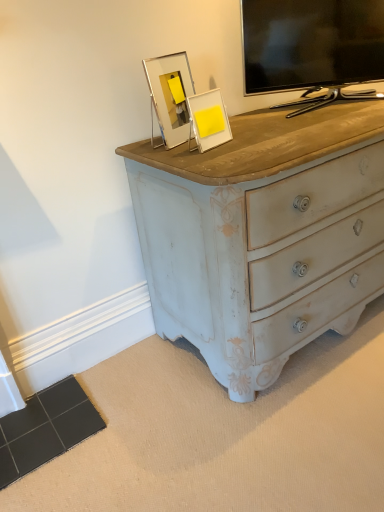
Question: Are clear acrylic frame at upper center, positioned as the 1th picture frame in left-to-right order, and black glossy tv at upper right located far from each other?

Choices:
 (A) no
 (B) yes

Answer: (A)

Question: Is clear acrylic frame at upper center, placed as the 2th picture frame when sorted from right to left, aimed at black glossy tv at upper right?

Choices:
 (A) no
 (B) yes

Answer: (A)

Question: Does clear acrylic frame at upper center, positioned as the 1th picture frame in left-to-right order, come in front of black glossy tv at upper right?

Choices:
 (A) yes
 (B) no

Answer: (A)

Question: Is clear acrylic frame at upper center, placed as the 2th picture frame when sorted from right to left, bigger than black glossy tv at upper right?

Choices:
 (A) yes
 (B) no

Answer: (B)

Question: Could black glossy tv at upper right be considered to be inside clear acrylic frame at upper center, placed as the 2th picture frame when sorted from right to left?

Choices:
 (A) yes
 (B) no

Answer: (B)

Question: From the image's perspective, would you say clear acrylic frame at upper center, placed as the 2th picture frame when sorted from right to left, is positioned over black glossy tv at upper right?

Choices:
 (A) yes
 (B) no

Answer: (B)

Question: Is black glossy tv at upper right wider than clear acrylic frame at upper center, placed as the 2th picture frame when sorted from right to left?

Choices:
 (A) no
 (B) yes

Answer: (B)

Question: Does black glossy tv at upper right come behind clear acrylic frame at upper center, placed as the 2th picture frame when sorted from right to left?

Choices:
 (A) no
 (B) yes

Answer: (B)

Question: Can we say black glossy tv at upper right lies outside clear acrylic frame at upper center, placed as the 2th picture frame when sorted from right to left?

Choices:
 (A) no
 (B) yes

Answer: (B)

Question: Is black glossy tv at upper right at the right side of clear acrylic frame at upper center, positioned as the 1th picture frame in left-to-right order?

Choices:
 (A) no
 (B) yes

Answer: (B)

Question: From the image's perspective, does black glossy tv at upper right appear higher than clear acrylic frame at upper center, positioned as the 1th picture frame in left-to-right order?

Choices:
 (A) yes
 (B) no

Answer: (A)

Question: Does black glossy tv at upper right have a lesser height compared to clear acrylic frame at upper center, placed as the 2th picture frame when sorted from right to left?

Choices:
 (A) yes
 (B) no

Answer: (B)

Question: Is yellow matte picture frame at upper center, which ranks as the 1th picture frame in right-to-left order, positioned before black glossy tv at upper right?

Choices:
 (A) no
 (B) yes

Answer: (B)